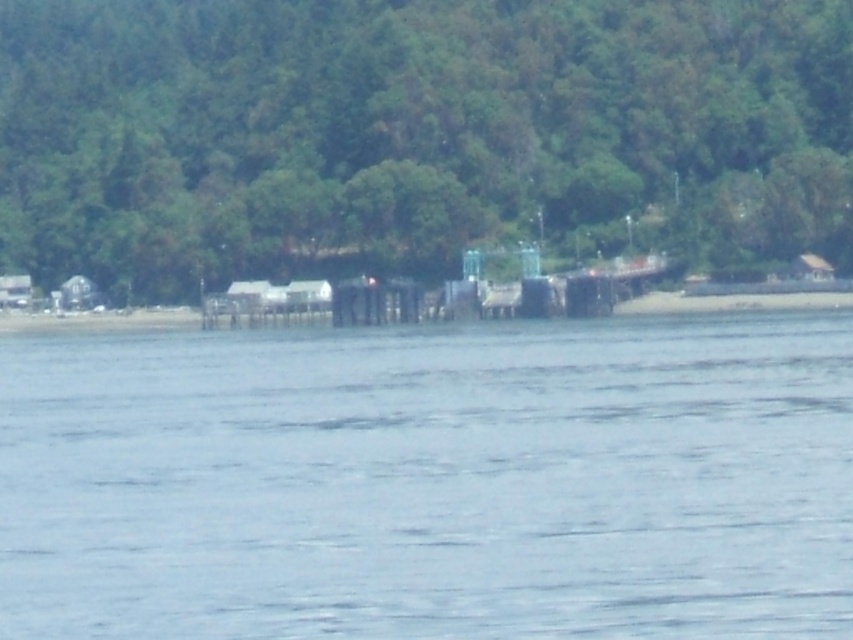
You are standing on a boat in the middle of the clear water at center and want to reach the wooden pier at center. Based on the scene, which direction should you head to reach the pier?

The wooden pier at center is located in the midground, so you should head towards the wooden pier at center from the clear water at center.

You are planning to take a photo of the green leafy tree at center and the wooden pier at center from a distance. Which object will appear wider in the photo?

The green leafy tree at center will appear wider in the photo because its width is larger than the wooden pier at center.